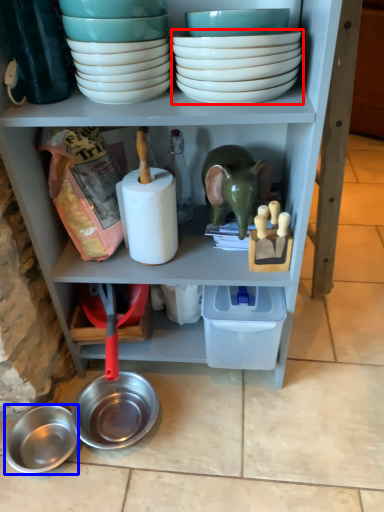
Question: Which point is further to the camera, bowl (highlighted by a red box) or bowl (highlighted by a blue box)?

Choices:
 (A) bowl
 (B) bowl

Answer: (B)